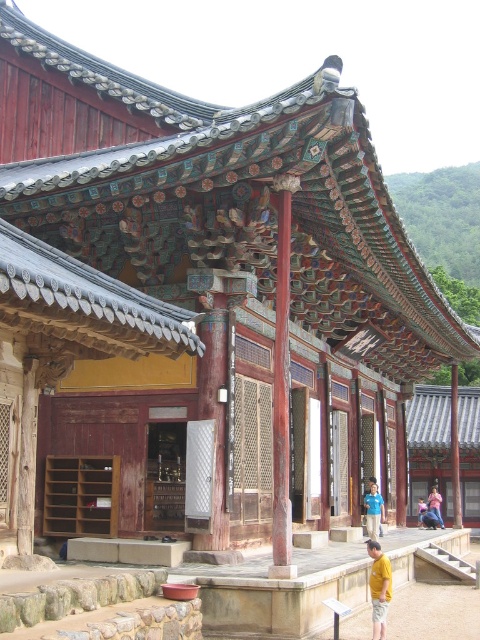
Based on the photo, you are standing in front of the temple and notice two items at the center. Which one is higher up, the wooden at center or the light blue shirt at center?

The wooden at center is located above the light blue shirt at center, so the wooden at center is higher up.